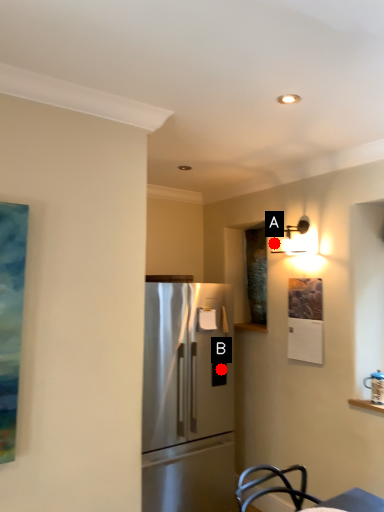
Question: Two points are circled on the image, labeled by A and B beside each circle. Among these points, which one is nearest to the camera?

Choices:
 (A) A is closer
 (B) B is closer

Answer: (B)